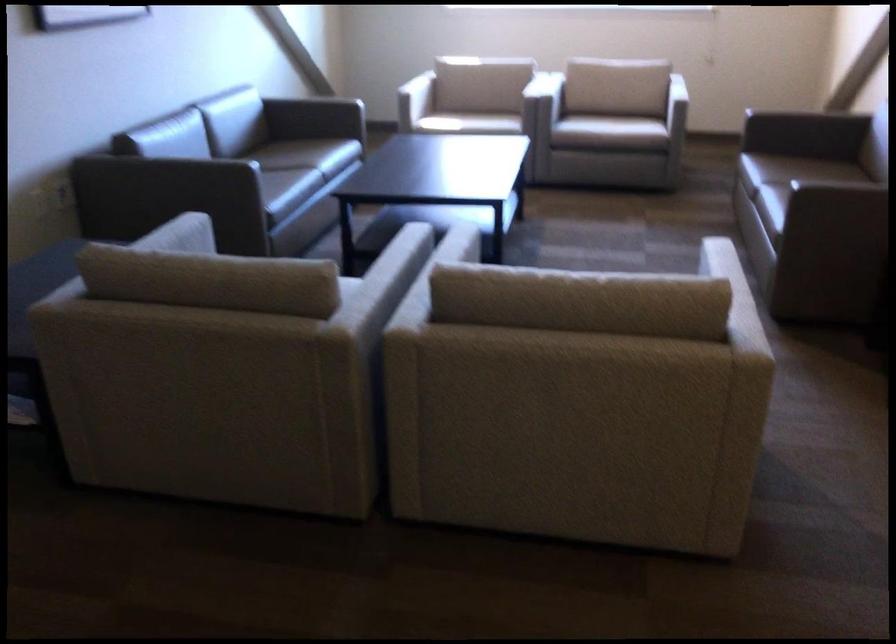
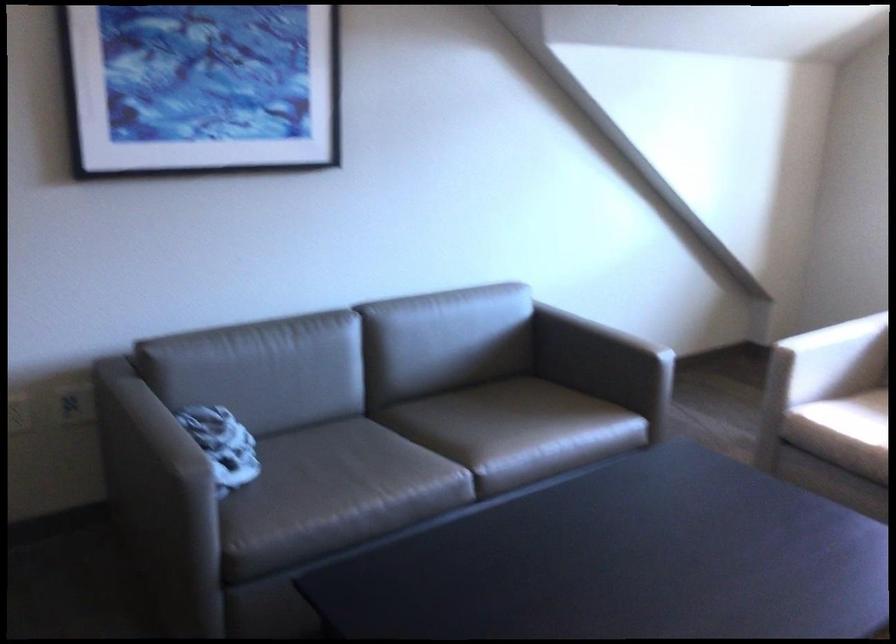
Locate, in the second image, the point that corresponds to (x=407, y=84) in the first image.

(831, 359)